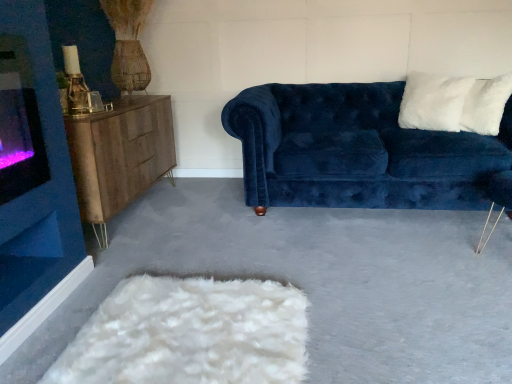
Question: Should I look upward or downward to see velvet blue couch at center?

Choices:
 (A) down
 (B) up

Answer: (B)

Question: From the image's perspective, is wooden sideboard at left above white fluffy pillow at upper right?

Choices:
 (A) no
 (B) yes

Answer: (A)

Question: Considering the relative positions of wooden sideboard at left and white fluffy pillow at upper right in the image provided, is wooden sideboard at left to the left of white fluffy pillow at upper right from the viewer's perspective?

Choices:
 (A) yes
 (B) no

Answer: (A)

Question: Is wooden sideboard at left at the right side of white fluffy pillow at upper right?

Choices:
 (A) no
 (B) yes

Answer: (A)

Question: Is wooden sideboard at left thinner than white fluffy pillow at upper right?

Choices:
 (A) no
 (B) yes

Answer: (A)

Question: Is wooden sideboard at left wider than white fluffy pillow at upper right?

Choices:
 (A) yes
 (B) no

Answer: (A)

Question: Does wooden sideboard at left have a smaller size compared to white fluffy pillow at upper right?

Choices:
 (A) yes
 (B) no

Answer: (B)

Question: Does velvet blue couch at center have a lesser width compared to white fluffy pillow at upper right?

Choices:
 (A) yes
 (B) no

Answer: (B)

Question: Is velvet blue couch at center further to camera compared to white fluffy pillow at upper right?

Choices:
 (A) yes
 (B) no

Answer: (B)

Question: Considering the relative sizes of velvet blue couch at center and white fluffy pillow at upper right in the image provided, is velvet blue couch at center bigger than white fluffy pillow at upper right?

Choices:
 (A) yes
 (B) no

Answer: (A)

Question: From the image's perspective, is velvet blue couch at center located above white fluffy pillow at upper right?

Choices:
 (A) yes
 (B) no

Answer: (B)

Question: Considering the relative positions of velvet blue couch at center and white fluffy pillow at upper right in the image provided, is velvet blue couch at center to the right of white fluffy pillow at upper right from the viewer's perspective?

Choices:
 (A) yes
 (B) no

Answer: (B)

Question: From a real-world perspective, does velvet blue couch at center sit lower than white fluffy pillow at upper right?

Choices:
 (A) yes
 (B) no

Answer: (A)

Question: From the image's perspective, is velvet blue couch at center on wooden sideboard at left?

Choices:
 (A) no
 (B) yes

Answer: (B)